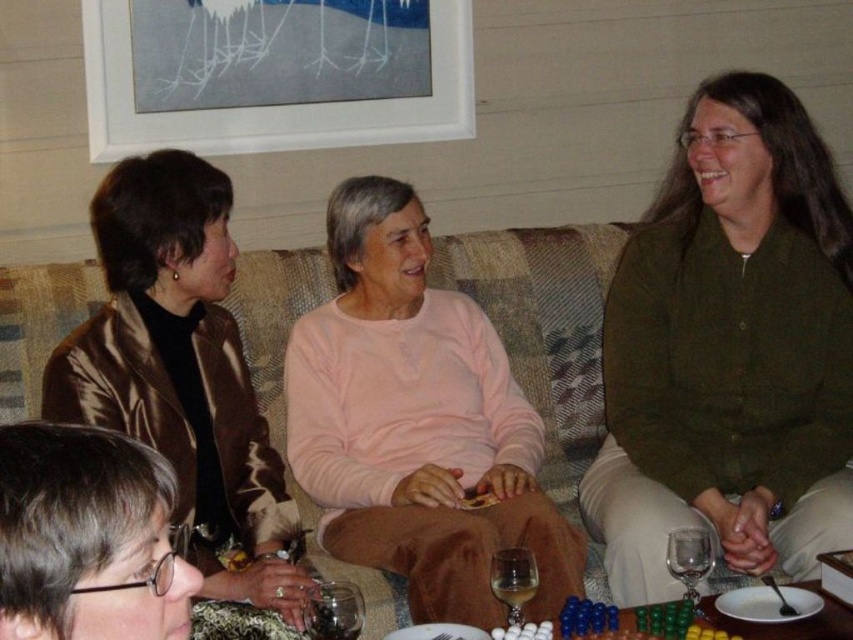
What do you see at coordinates (788, 620) in the screenshot? I see `translucent glass table at lower center` at bounding box center [788, 620].

Between point (775, 634) and point (494, 556), which one is positioned in front?

Point (775, 634) is more forward.

Measure the distance between translucent glass table at lower center and camera.

translucent glass table at lower center and camera are 1.56 meters apart from each other.

At what (x,y) coordinates should I click in order to perform the action: click on translucent glass table at lower center. Please return your answer as a coordinate pair (x, y). The height and width of the screenshot is (640, 853). Looking at the image, I should click on (788, 620).

Which is more to the left, white matte picture frame at upper center or transparent glass at lower center?

white matte picture frame at upper center

Is white matte picture frame at upper center to the left of transparent glass at lower center from the viewer's perspective?

Yes, white matte picture frame at upper center is to the left of transparent glass at lower center.

Does point (312, 122) come behind point (317, 625)?

Yes, point (312, 122) is farther from viewer.

Where is `white matte picture frame at upper center`? This screenshot has width=853, height=640. white matte picture frame at upper center is located at coordinates (274, 100).

Is transparent glass at lower center shorter than transparent glass wine glass at lower center?

Indeed, transparent glass at lower center has a lesser height compared to transparent glass wine glass at lower center.

Which is more to the right, transparent glass at lower center or transparent glass wine glass at lower center?

Positioned to the right is transparent glass wine glass at lower center.

Is point (312, 586) positioned after point (682, 544)?

That is True.

At what (x,y) coordinates should I click in order to perform the action: click on transparent glass at lower center. Please return your answer as a coordinate pair (x, y). Looking at the image, I should click on (334, 611).